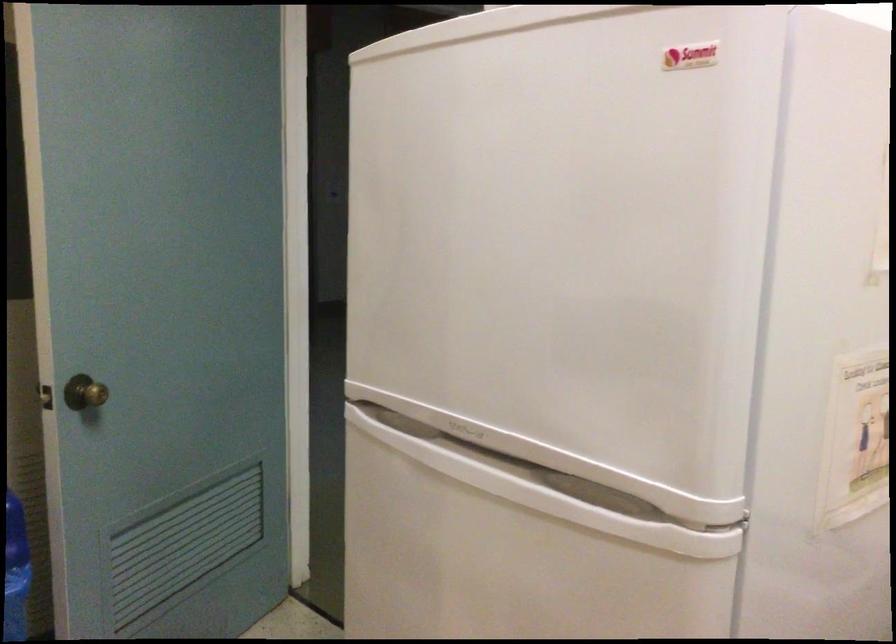
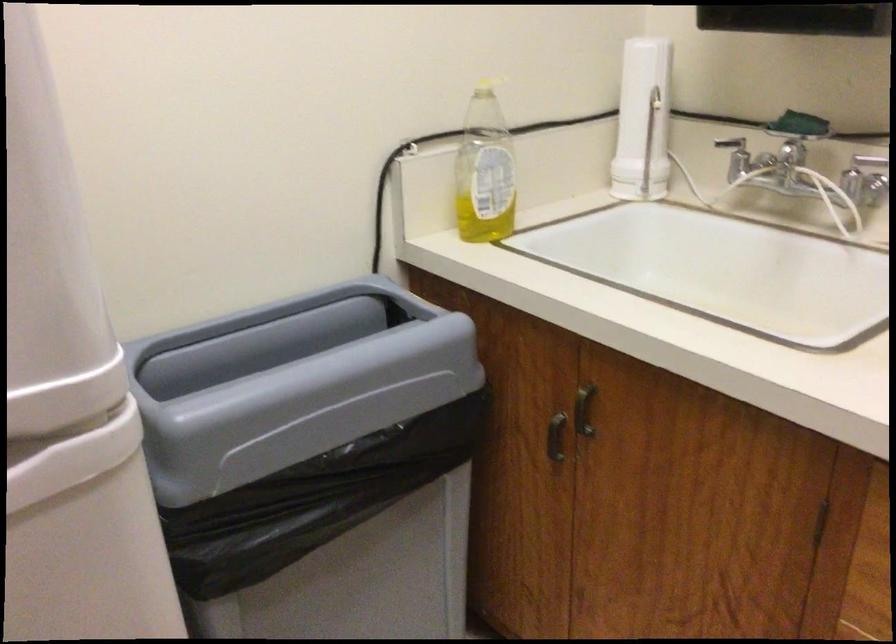
First-person continuous shooting, in which direction is the camera rotating?

The camera's rotation is toward right-down.